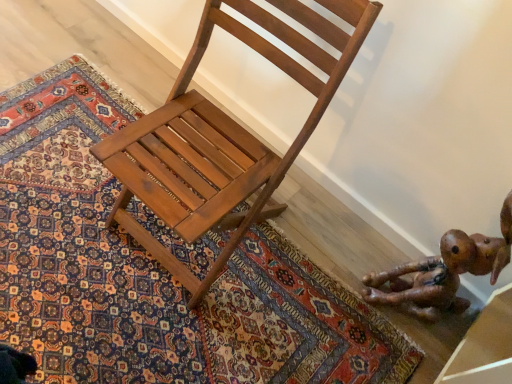
Question: Can you confirm if carpeted rug at center is taller than brown leather toy at lower right?

Choices:
 (A) no
 (B) yes

Answer: (A)

Question: Can you confirm if carpeted rug at center is positioned to the right of brown leather toy at lower right?

Choices:
 (A) no
 (B) yes

Answer: (A)

Question: Could you tell me if carpeted rug at center is turned towards brown leather toy at lower right?

Choices:
 (A) no
 (B) yes

Answer: (A)

Question: Is carpeted rug at center placed right next to brown leather toy at lower right?

Choices:
 (A) yes
 (B) no

Answer: (B)

Question: Is carpeted rug at center oriented away from brown leather toy at lower right?

Choices:
 (A) no
 (B) yes

Answer: (A)

Question: From the image's perspective, is carpeted rug at center located beneath brown leather toy at lower right?

Choices:
 (A) no
 (B) yes

Answer: (A)

Question: From a real-world perspective, does carpeted rug at center sit lower than shiny brown wood chair at center?

Choices:
 (A) no
 (B) yes

Answer: (B)

Question: Is carpeted rug at center smaller than shiny brown wood chair at center?

Choices:
 (A) yes
 (B) no

Answer: (A)

Question: Does carpeted rug at center have a larger size compared to shiny brown wood chair at center?

Choices:
 (A) yes
 (B) no

Answer: (B)

Question: Is carpeted rug at center shorter than shiny brown wood chair at center?

Choices:
 (A) yes
 (B) no

Answer: (A)

Question: Considering the relative positions of carpeted rug at center and shiny brown wood chair at center in the image provided, is carpeted rug at center to the left of shiny brown wood chair at center from the viewer's perspective?

Choices:
 (A) no
 (B) yes

Answer: (B)

Question: Is carpeted rug at center taller than shiny brown wood chair at center?

Choices:
 (A) yes
 (B) no

Answer: (B)

Question: From the image's perspective, is brown leather toy at lower right above carpeted rug at center?

Choices:
 (A) yes
 (B) no

Answer: (B)